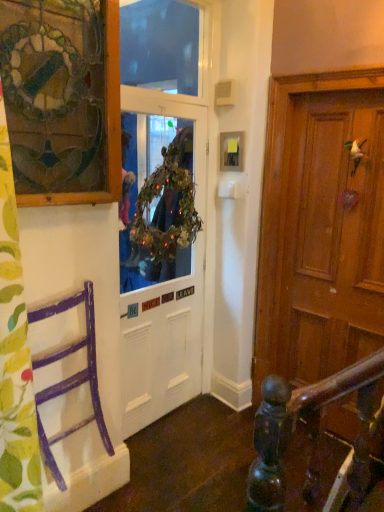
Question: Is purple painted wood chair at left bigger than transparent plastic window screen at upper center, the second window screen positioned from the bottom?

Choices:
 (A) no
 (B) yes

Answer: (B)

Question: From the image's perspective, is purple painted wood chair at left on transparent plastic window screen at upper center, the second window screen positioned from the bottom?

Choices:
 (A) no
 (B) yes

Answer: (A)

Question: Is transparent plastic window screen at upper center, the second window screen positioned from the bottom, inside purple painted wood chair at left?

Choices:
 (A) yes
 (B) no

Answer: (B)

Question: Is purple painted wood chair at left to the left of transparent plastic window screen at upper center, the second window screen positioned from the bottom, from the viewer's perspective?

Choices:
 (A) yes
 (B) no

Answer: (A)

Question: Is purple painted wood chair at left far away from transparent plastic window screen at upper center, the second window screen positioned from the bottom?

Choices:
 (A) yes
 (B) no

Answer: (A)

Question: From the image's perspective, is purple painted wood chair at left beneath transparent plastic window screen at upper center, the second window screen positioned from the bottom?

Choices:
 (A) no
 (B) yes

Answer: (B)

Question: From a real-world perspective, is green leafy fabric at left beneath white matte door at center?

Choices:
 (A) no
 (B) yes

Answer: (A)

Question: Is the position of green leafy fabric at left less distant than that of white matte door at center?

Choices:
 (A) no
 (B) yes

Answer: (B)

Question: Is the position of green leafy fabric at left more distant than that of white matte door at center?

Choices:
 (A) yes
 (B) no

Answer: (B)

Question: Does green leafy fabric at left have a lesser height compared to white matte door at center?

Choices:
 (A) yes
 (B) no

Answer: (A)

Question: Is green leafy fabric at left aimed at white matte door at center?

Choices:
 (A) no
 (B) yes

Answer: (A)

Question: Is green leafy fabric at left to the left of white matte door at center from the viewer's perspective?

Choices:
 (A) no
 (B) yes

Answer: (B)

Question: Are green leafy wreath at center, marked as the second window screen in a top-to-bottom arrangement, and white matte door at center making contact?

Choices:
 (A) yes
 (B) no

Answer: (B)